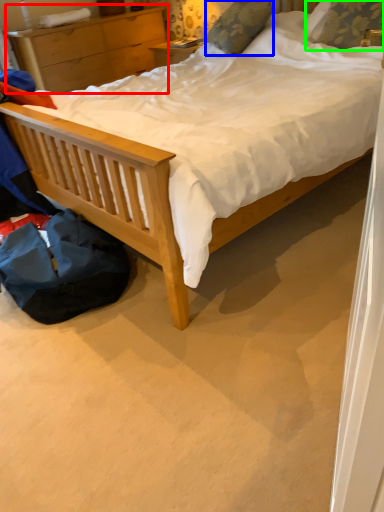
Question: Which object is positioned closest to nightstand (highlighted by a red box)? Select from pillow (highlighted by a blue box) and pillow (highlighted by a green box).

Choices:
 (A) pillow
 (B) pillow

Answer: (A)